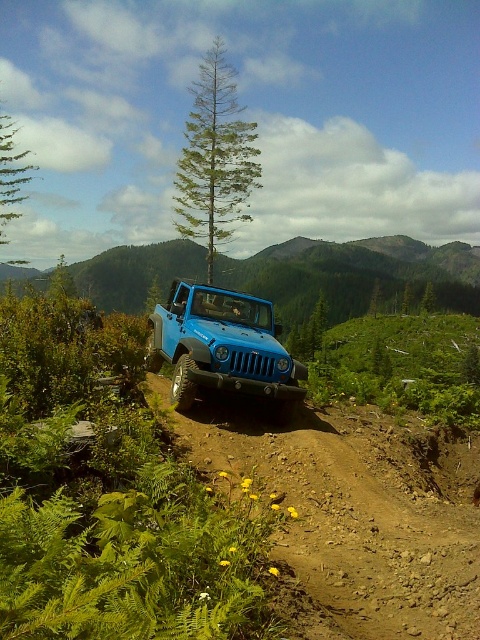
Question: Does matte blue jeep at center have a lesser width compared to green needle-like tree at center?

Choices:
 (A) no
 (B) yes

Answer: (B)

Question: Does brown rocky dirt track at center have a lesser width compared to green needle-like tree at center?

Choices:
 (A) no
 (B) yes

Answer: (B)

Question: Which object is farther from the camera taking this photo?

Choices:
 (A) brown rocky dirt track at center
 (B) green needle-like tree at center
 (C) green leafy shrubs at center
 (D) matte blue jeep at center

Answer: (B)

Question: In this image, where is brown rocky dirt track at center located relative to green leafy shrubs at center?

Choices:
 (A) right
 (B) left

Answer: (B)

Question: Which object appears closest to the camera in this image?

Choices:
 (A) green needle-like tree at center
 (B) matte blue jeep at center
 (C) brown rocky dirt track at center
 (D) green leafy shrubs at center

Answer: (C)

Question: Which object is the farthest from the green leafy shrubs at center?

Choices:
 (A) brown rocky dirt track at center
 (B) matte blue jeep at center

Answer: (B)